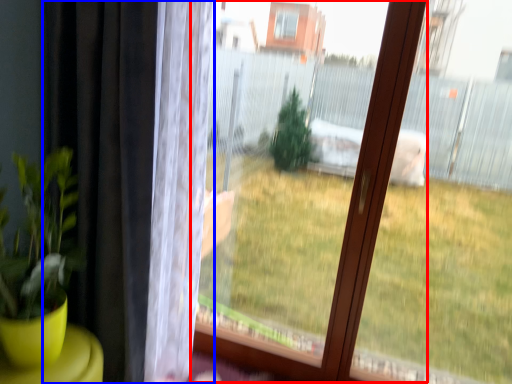
Question: Which point is closer to the camera, bay window (highlighted by a red box) or curtain (highlighted by a blue box)?

Choices:
 (A) bay window
 (B) curtain

Answer: (B)